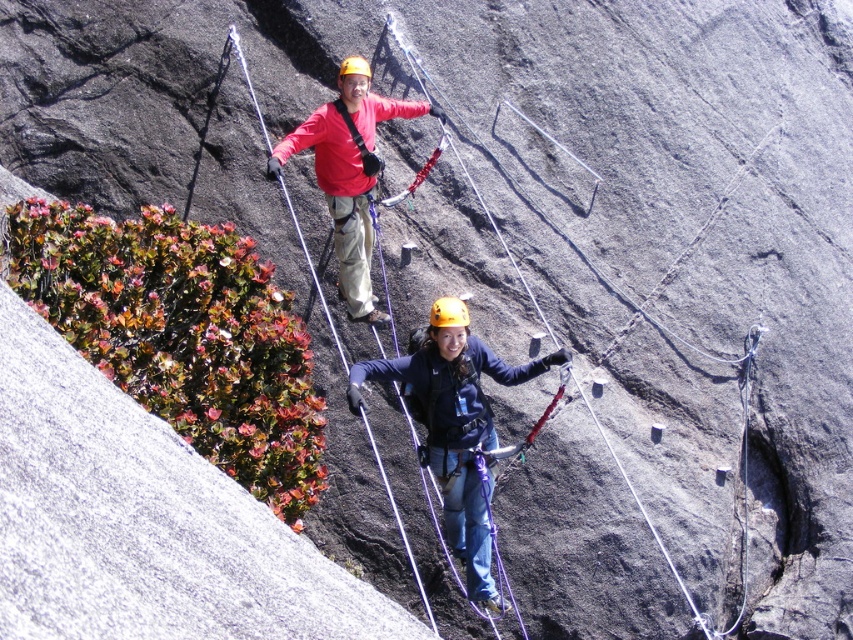
Question: Can you confirm if matte blue jacket at center is smaller than matte red jacket at upper center?

Choices:
 (A) yes
 (B) no

Answer: (B)

Question: Which point is farther from the camera taking this photo?

Choices:
 (A) click(x=418, y=451)
 (B) click(x=457, y=317)

Answer: (A)

Question: Which object is farther from the camera taking this photo?

Choices:
 (A) yellow matte helmet at center
 (B) matte blue jacket at center

Answer: (A)

Question: Is matte red jacket at upper center closer to camera compared to yellow matte helmet at center?

Choices:
 (A) yes
 (B) no

Answer: (B)

Question: Is matte red jacket at upper center above yellow matte helmet at center?

Choices:
 (A) yes
 (B) no

Answer: (A)

Question: Based on their relative distances, which object is farther from the matte red jacket at upper center?

Choices:
 (A) yellow matte helmet at center
 (B) matte blue jacket at center

Answer: (B)